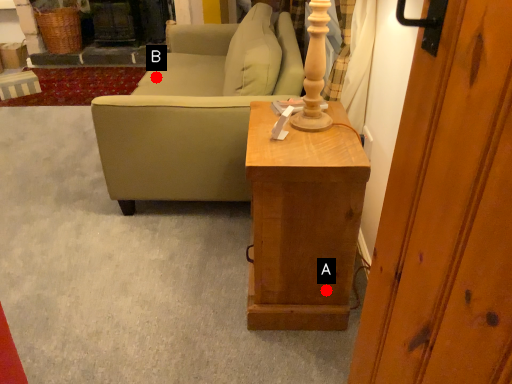
Question: Two points are circled on the image, labeled by A and B beside each circle. Which of the following is the closest to the observer?

Choices:
 (A) A is closer
 (B) B is closer

Answer: (A)